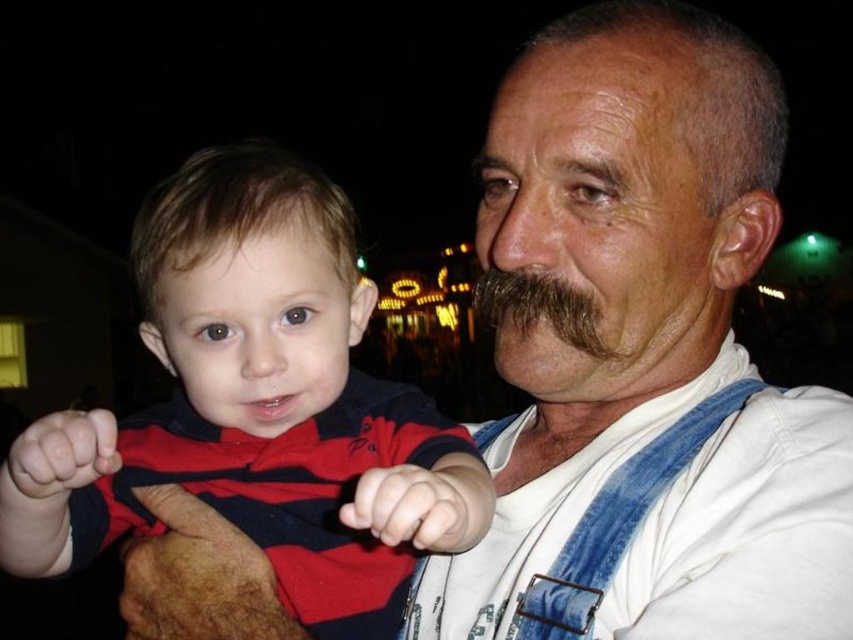
Is striped cotton shirt at left above brown fuzzy mustache at center?

Actually, striped cotton shirt at left is below brown fuzzy mustache at center.

Is striped cotton shirt at left positioned at the back of brown fuzzy mustache at center?

No.

Which is in front, point (158, 452) or point (535, 305)?

Positioned in front is point (158, 452).

Image resolution: width=853 pixels, height=640 pixels. I want to click on striped cotton shirt at left, so click(x=257, y=406).

This screenshot has height=640, width=853. In order to click on blue denim suspenders at center in this screenshot , I will do `click(618, 522)`.

Who is higher up, blue denim suspenders at center or brown fuzzy mustache at center?

brown fuzzy mustache at center is higher up.

Locate an element on the screen. This screenshot has width=853, height=640. blue denim suspenders at center is located at coordinates (618, 522).

Does striped cotton shirt at left have a lesser width compared to blue denim suspenders at center?

No.

Does striped cotton shirt at left have a lesser height compared to blue denim suspenders at center?

No.

This screenshot has width=853, height=640. Identify the location of striped cotton shirt at left. (257, 406).